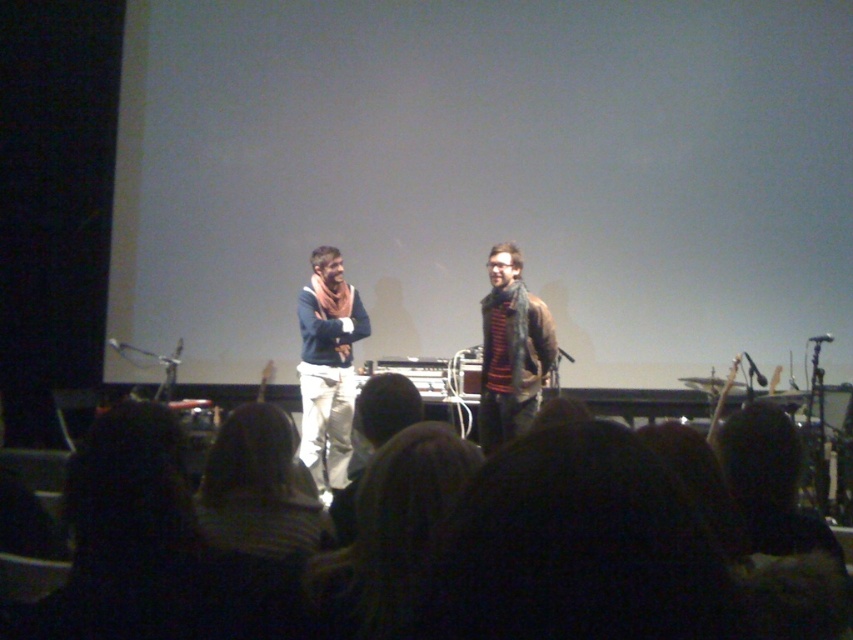
Question: Which object appears closest to the camera in this image?

Choices:
 (A) metallic silver microphone at upper center
 (B) striped knit sweater at center
 (C) matte blue sweater at center

Answer: (B)

Question: In this image, where is matte blue sweater at center located relative to metallic silver microphone at upper center?

Choices:
 (A) below
 (B) above

Answer: (A)

Question: Which point is closer to the camera?

Choices:
 (A) matte blue sweater at center
 (B) striped knit sweater at center
 (C) metallic silver microphone at upper center

Answer: (B)

Question: Which object is closer to the camera taking this photo?

Choices:
 (A) matte blue sweater at center
 (B) metallic silver microphone at upper center

Answer: (A)

Question: Does striped knit sweater at center appear on the left side of metallic silver microphone at upper center?

Choices:
 (A) yes
 (B) no

Answer: (A)

Question: Can you confirm if matte blue sweater at center is positioned above striped knit sweater at center?

Choices:
 (A) yes
 (B) no

Answer: (B)